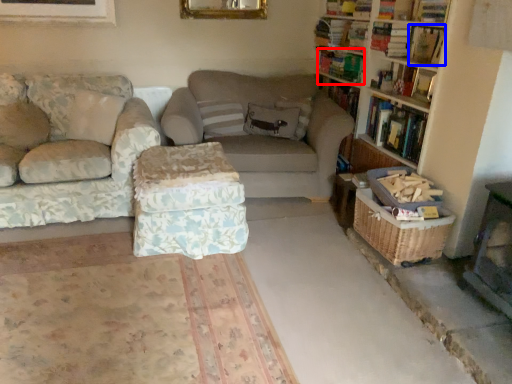
Question: Which object is further to the camera taking this photo, book (highlighted by a red box) or book (highlighted by a blue box)?

Choices:
 (A) book
 (B) book

Answer: (A)